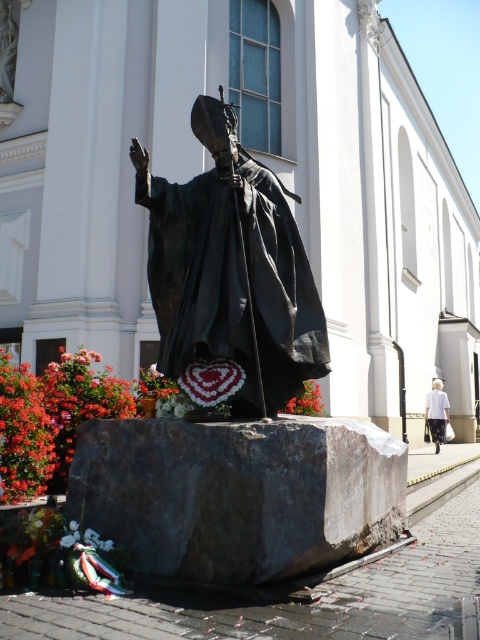
Does white stone church at center appear on the right side of bronze statue at center?

Yes, white stone church at center is to the right of bronze statue at center.

Who is positioned more to the right, white stone church at center or bronze statue at center?

Positioned to the right is white stone church at center.

Between point (408, 256) and point (204, 211), which one is positioned behind?

Positioned behind is point (408, 256).

This screenshot has height=640, width=480. In order to click on white stone church at center in this screenshot , I will do `click(212, 164)`.

Can you confirm if gray rough stone at center is positioned above white cotton shirt at lower right?

Yes.

Describe the element at coordinates (238, 493) in the screenshot. I see `gray rough stone at center` at that location.

Measure the distance between point [347,500] and camera.

Point [347,500] is 15.36 feet away from camera.

I want to click on gray rough stone at center, so click(x=238, y=493).

Between white stone church at center and white cotton shirt at lower right, which one is positioned lower?

white cotton shirt at lower right

Is white stone church at center to the right of white cotton shirt at lower right from the viewer's perspective?

No, white stone church at center is not to the right of white cotton shirt at lower right.

Which is in front, point (324, 193) or point (444, 433)?

Point (324, 193) is in front.

Find the location of a particular element. white stone church at center is located at coordinates (212, 164).